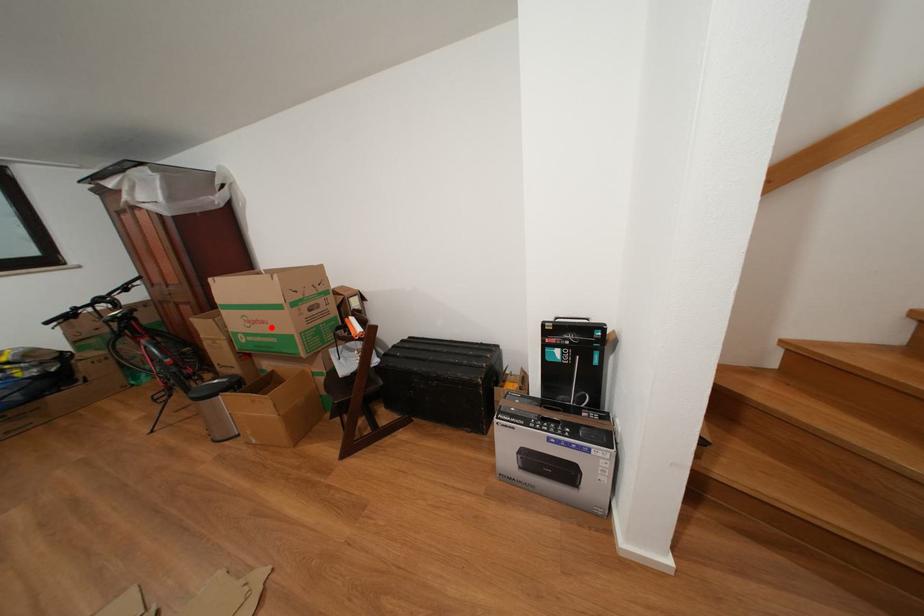
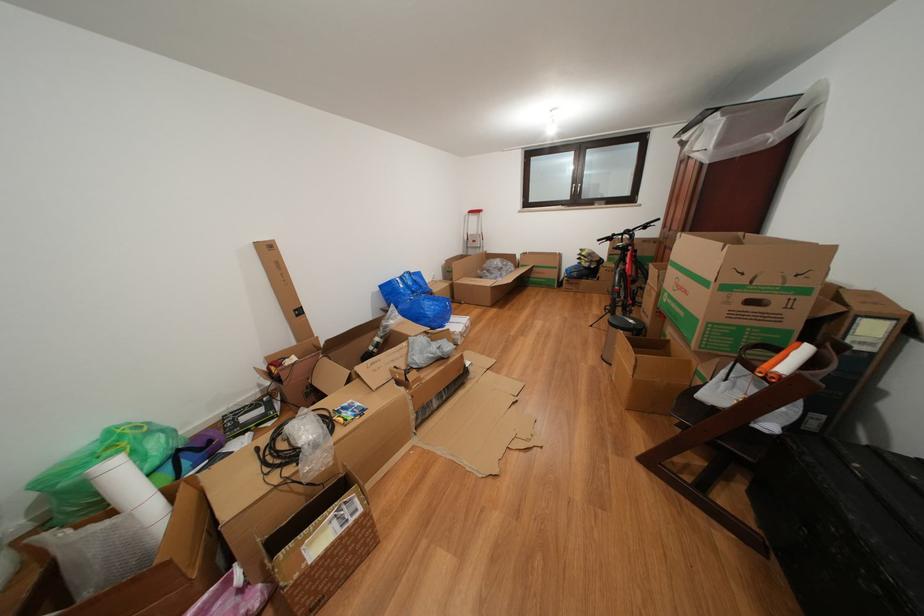
Find the pixel in the second image that matches the highlighted location in the first image.

(694, 297)